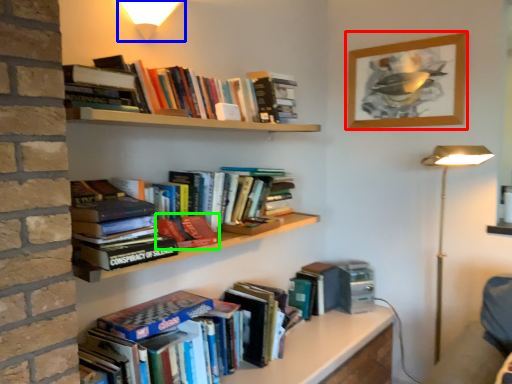
Question: Which is farther away from picture frame (highlighted by a red box)? light fixture (highlighted by a blue box) or book (highlighted by a green box)?

Choices:
 (A) light fixture
 (B) book

Answer: (B)